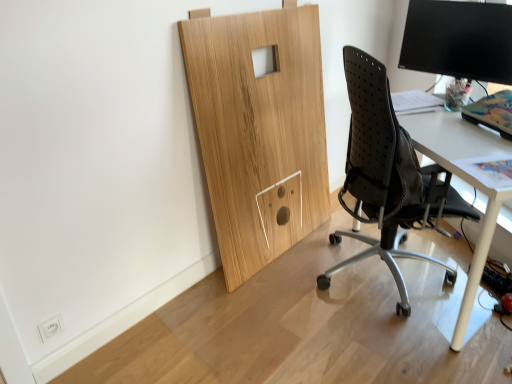
Question: Does point (388, 89) appear closer or farther from the camera than point (459, 33)?

Choices:
 (A) farther
 (B) closer

Answer: (B)

Question: Is black mesh chair at right taller or shorter than black glossy monitor at upper right?

Choices:
 (A) short
 (B) tall

Answer: (B)

Question: Considering the real-world distances, which object is closest to the black mesh chair at right?

Choices:
 (A) black glossy monitor at upper right
 (B) white glossy desk at right

Answer: (B)

Question: Which object is positioned closest to the white glossy desk at right?

Choices:
 (A) black glossy monitor at upper right
 (B) black mesh chair at right

Answer: (B)